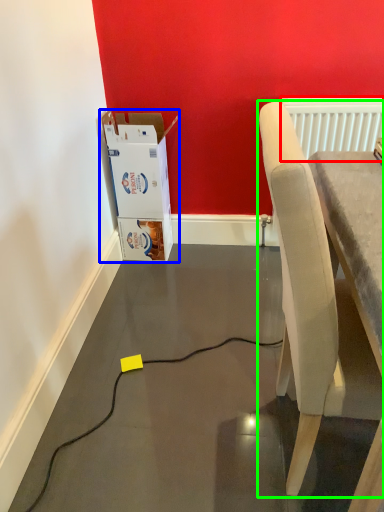
Question: Considering the real-world distances, which object is closest to radiator (highlighted by a red box)? cardboard box (highlighted by a blue box) or chair (highlighted by a green box).

Choices:
 (A) cardboard box
 (B) chair

Answer: (A)